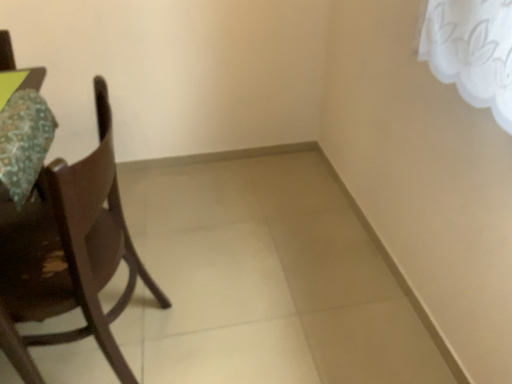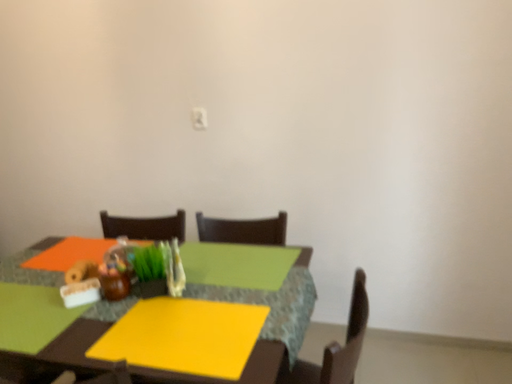
Question: How did the camera likely rotate when shooting the video?

Choices:
 (A) rotated downward
 (B) rotated upward

Answer: (B)